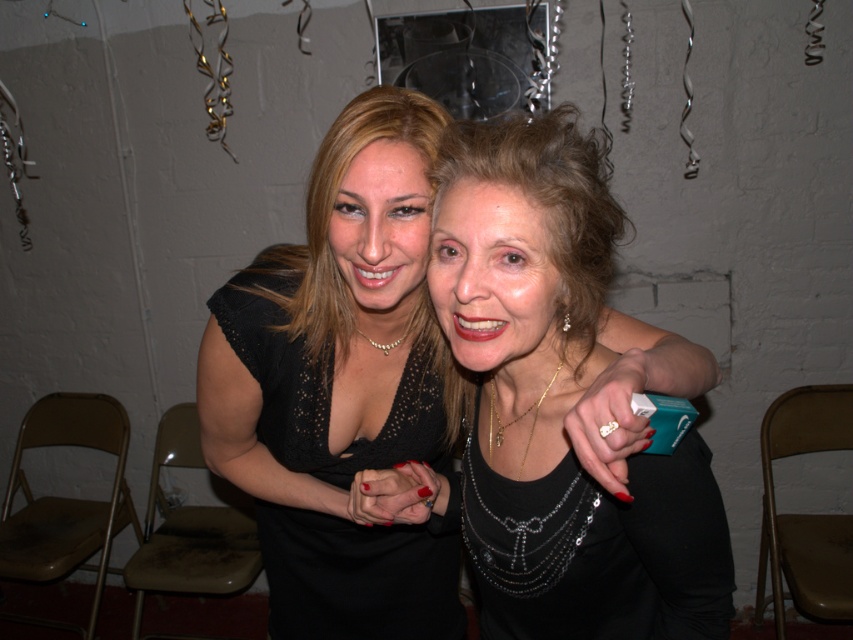
Looking at this image, you are a photographer at the event and want to place a small bouquet of flowers exactly at the center of the image. However, you must ensure that the bouquet does not overlap with the black satin dress at center. Given the coordinates provided, can you determine if placing the bouquet at the exact center of the image would cause an overlap?

The black satin dress at center is located at coordinates point (341, 388), which is not the exact center of the image. Therefore, placing the bouquet at the exact center would not overlap with the black satin dress at center.

You are standing in a room with two women and want to take a photo of the point at coordinates point (289, 632). Can you estimate how far you need to move forward to focus on this point?

The point (289, 632) is 1.24 meters away from the camera, so you need to move forward to that distance to focus on it.

You are a photographer at a fashion show and need to decide which dress to feature in the next photo. Both the black satin dress at center and the black lace dress at center are available. Based on their sizes, which dress should you choose if you want to highlight a taller garment?

The black satin dress at center is taller than the black lace dress at center, so it should be chosen to highlight a taller garment.